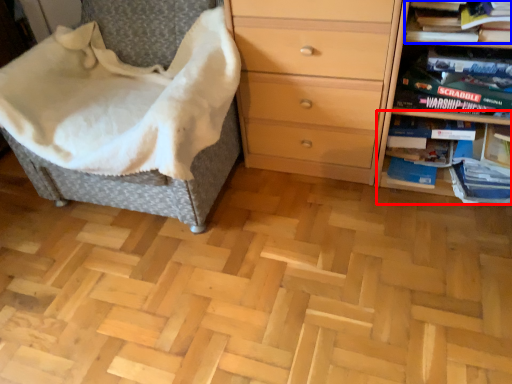
Question: Which of the following is the closest to the observer, shelf (highlighted by a red box) or book (highlighted by a blue box)?

Choices:
 (A) shelf
 (B) book

Answer: (B)